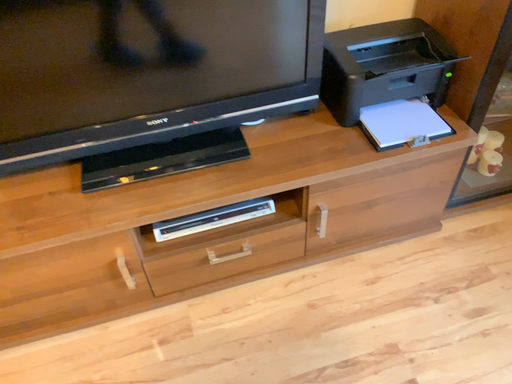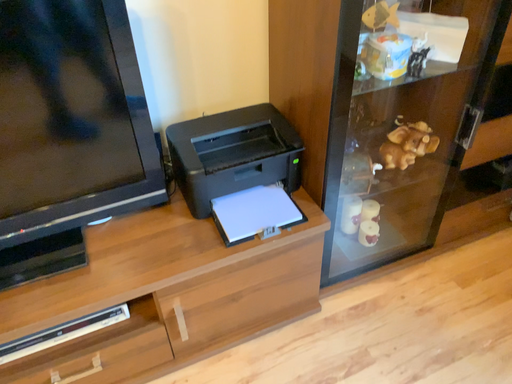
Question: How did the camera likely rotate when shooting the video?

Choices:
 (A) rotated downward
 (B) rotated upward

Answer: (B)